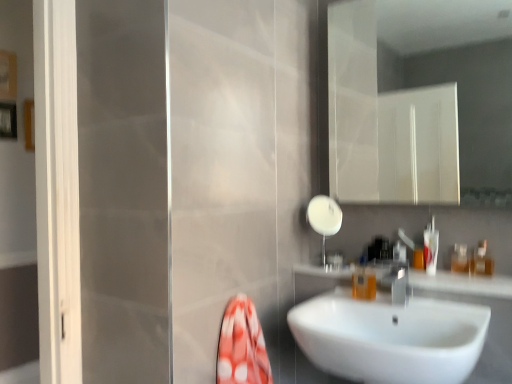
Question: Does translucent plastic bottle at right, the 1th toiletry in the left-to-right sequence, have a larger size compared to white glossy sink at center?

Choices:
 (A) yes
 (B) no

Answer: (B)

Question: Is white glossy sink at center completely or partially inside translucent plastic bottle at right, the third toiletry viewed from the right?

Choices:
 (A) yes
 (B) no

Answer: (B)

Question: Is translucent plastic bottle at right, the third toiletry viewed from the right, facing towards white glossy sink at center?

Choices:
 (A) no
 (B) yes

Answer: (A)

Question: Is the position of translucent plastic bottle at right, the third toiletry viewed from the right, less distant than that of white glossy sink at center?

Choices:
 (A) yes
 (B) no

Answer: (B)

Question: Can you confirm if translucent plastic bottle at right, the third toiletry viewed from the right, is shorter than white glossy sink at center?

Choices:
 (A) no
 (B) yes

Answer: (B)

Question: Is point (398, 289) positioned closer to the camera than point (294, 332)?

Choices:
 (A) farther
 (B) closer

Answer: (A)

Question: From the image's perspective, is silver metallic tap at sink right positioned above or below white glossy sink at center?

Choices:
 (A) above
 (B) below

Answer: (A)

Question: Is silver metallic tap at sink right situated inside white glossy sink at center or outside?

Choices:
 (A) outside
 (B) inside

Answer: (A)

Question: Is silver metallic tap at sink right wider or thinner than white glossy sink at center?

Choices:
 (A) thin
 (B) wide

Answer: (A)

Question: Would you say translucent plastic bottle at right, the 1th toiletry from the right, is to the left or to the right of silver metallic tap at sink right in the picture?

Choices:
 (A) right
 (B) left

Answer: (A)

Question: Is translucent plastic bottle at right, the 1th toiletry from the right, bigger or smaller than silver metallic tap at sink right?

Choices:
 (A) big
 (B) small

Answer: (B)

Question: Is translucent plastic bottle at right, the 1th toiletry from the right, in front of or behind silver metallic tap at sink right in the image?

Choices:
 (A) behind
 (B) front

Answer: (A)

Question: In terms of width, does translucent plastic bottle at right, the 1th toiletry from the right, look wider or thinner when compared to silver metallic tap at sink right?

Choices:
 (A) thin
 (B) wide

Answer: (A)

Question: From their relative heights in the image, would you say white glossy sink at center is taller or shorter than translucent plastic bottle at right, the 1th toiletry from the right?

Choices:
 (A) tall
 (B) short

Answer: (A)

Question: From the image's perspective, is white glossy sink at center above or below translucent plastic bottle at right, which is counted as the third toiletry, starting from the left?

Choices:
 (A) above
 (B) below

Answer: (B)